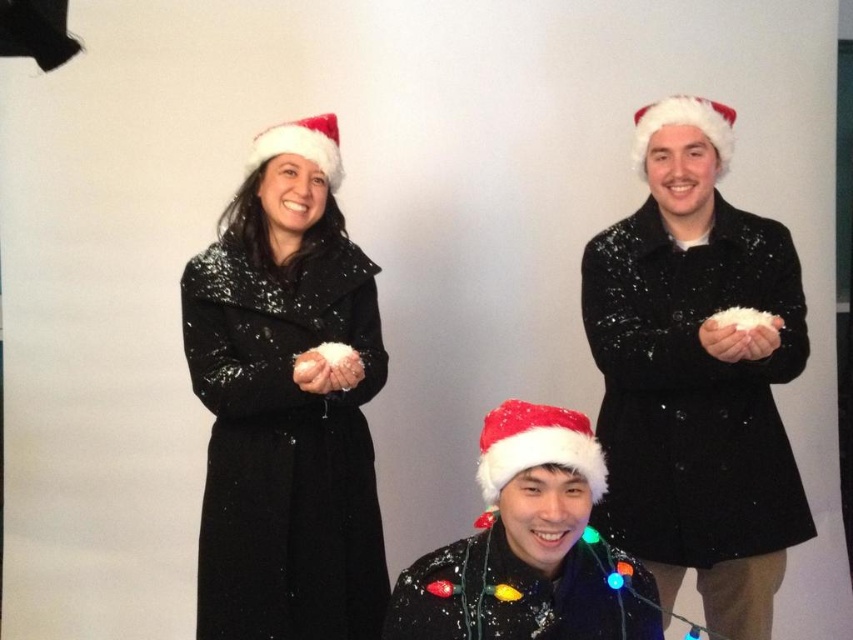
Is sparkly black coat at center closer to camera compared to red velvet santa hat at center?

No, sparkly black coat at center is behind red velvet santa hat at center.

Between sparkly black coat at center and red velvet santa hat at center, which one has less height?

red velvet santa hat at center is shorter.

Which is behind, point (744, 468) or point (550, 406)?

Point (744, 468)

This screenshot has width=853, height=640. In order to click on sparkly black coat at center in this screenshot , I will do `click(695, 374)`.

Can you confirm if glossy sequined coat at center is thinner than red felt santa hat at upper left?

No, glossy sequined coat at center is not thinner than red felt santa hat at upper left.

At what (x,y) coordinates should I click in order to perform the action: click on glossy sequined coat at center. Please return your answer as a coordinate pair (x, y). Image resolution: width=853 pixels, height=640 pixels. Looking at the image, I should click on (286, 403).

Locate an element on the screen. glossy sequined coat at center is located at coordinates (286, 403).

I want to click on glossy sequined coat at center, so click(x=286, y=403).

At what (x,y) coordinates should I click in order to perform the action: click on fuzzy black sweater at center. Please return your answer as a coordinate pair (x, y). Looking at the image, I should click on (529, 547).

Describe the element at coordinates (529, 547) in the screenshot. I see `fuzzy black sweater at center` at that location.

Is point (532, 584) in front of point (485, 458)?

That is True.

This screenshot has height=640, width=853. I want to click on fuzzy black sweater at center, so click(529, 547).